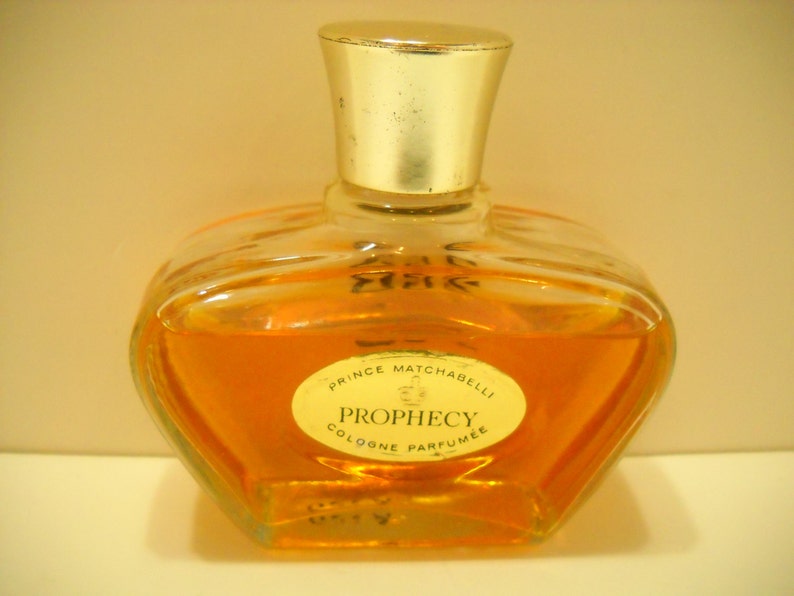
Where is `wall`? wall is located at coordinates (78, 88).